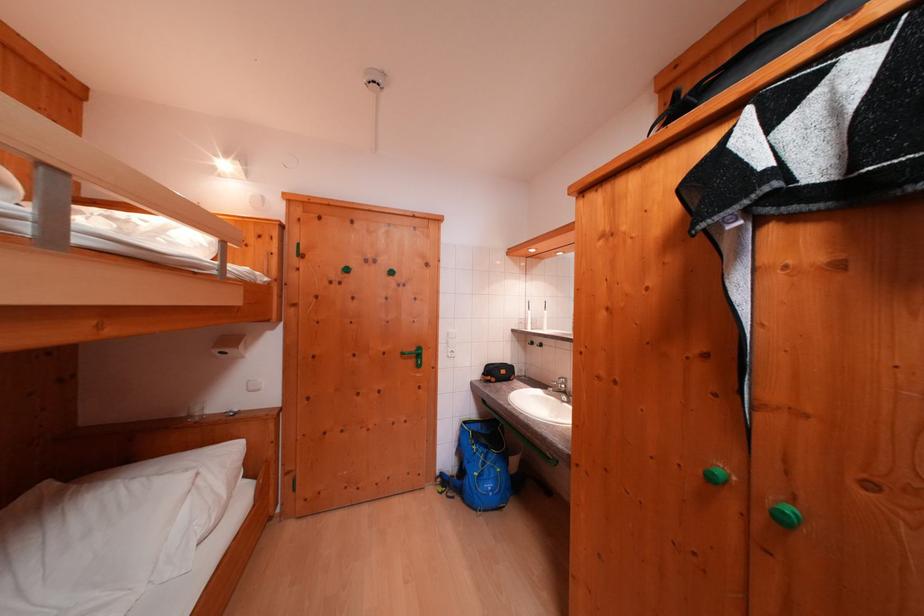
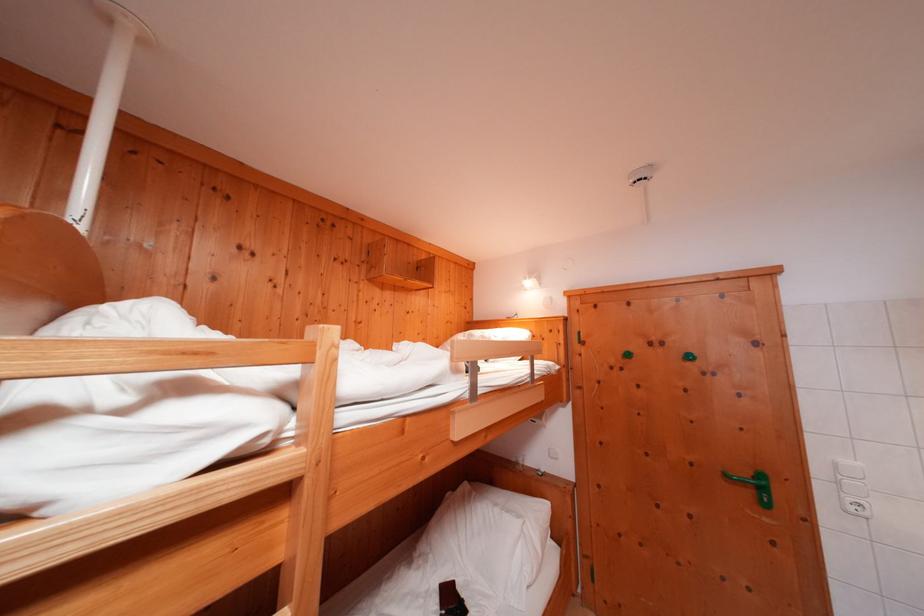
The point at (246, 418) is marked in the first image. Where is the corresponding point in the second image?

(552, 477)